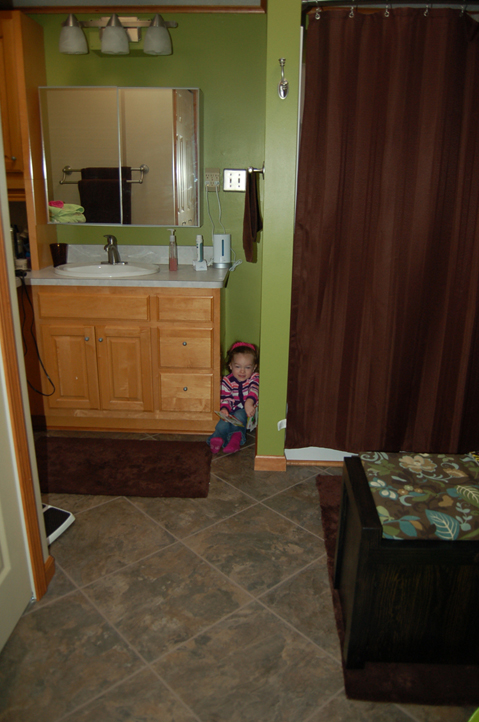
The width and height of the screenshot is (479, 722). I want to click on sink faucet, so click(x=108, y=245).